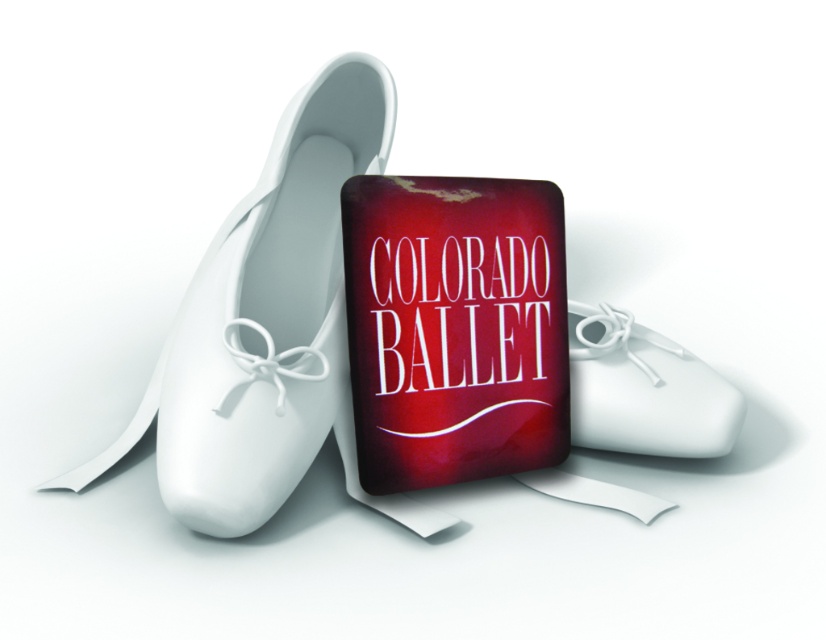
Does matte white ballet shoe at center appear on the right side of white matte ballet shoe at center?

Incorrect, matte white ballet shoe at center is not on the right side of white matte ballet shoe at center.

Does matte white ballet shoe at center have a smaller size compared to white matte ballet shoe at center?

Actually, matte white ballet shoe at center might be larger than white matte ballet shoe at center.

Find the location of a particular element. matte white ballet shoe at center is located at coordinates (268, 314).

At what (x,y) coordinates should I click in order to perform the action: click on matte white ballet shoe at center. Please return your answer as a coordinate pair (x, y). This screenshot has height=640, width=826. Looking at the image, I should click on (268, 314).